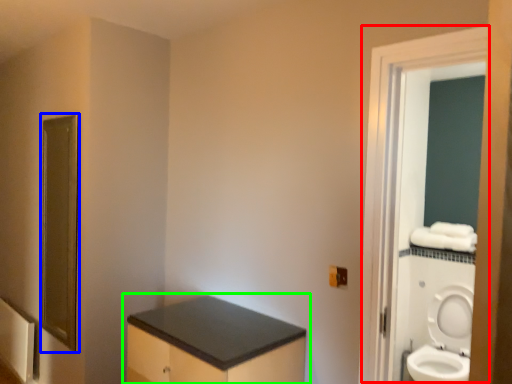
Question: Which is nearer to the screen door (highlighted by a red box)? mirror (highlighted by a blue box) or bathroom cabinet (highlighted by a green box).

Choices:
 (A) mirror
 (B) bathroom cabinet

Answer: (B)